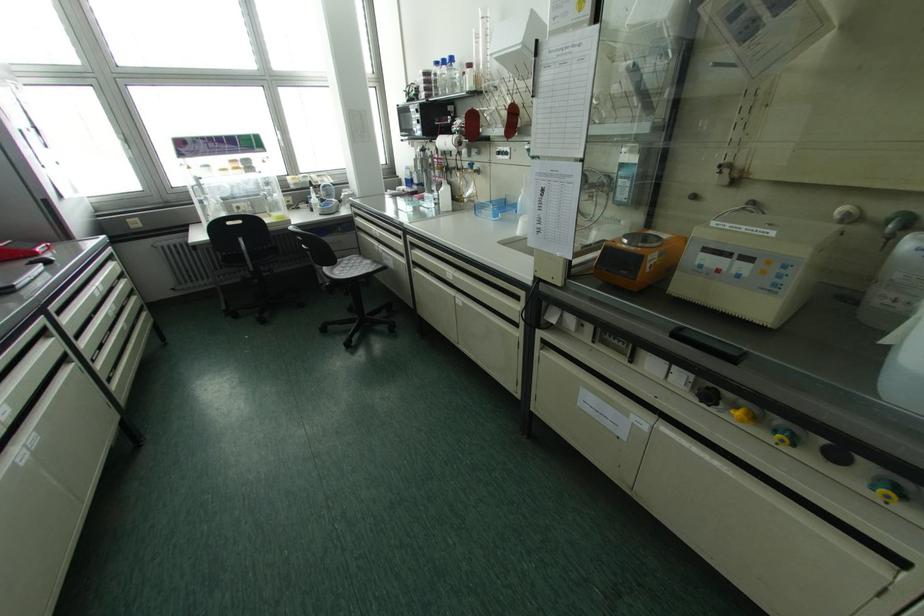
This screenshot has height=616, width=924. Describe the element at coordinates (898, 224) in the screenshot. I see `the faucet handle` at that location.